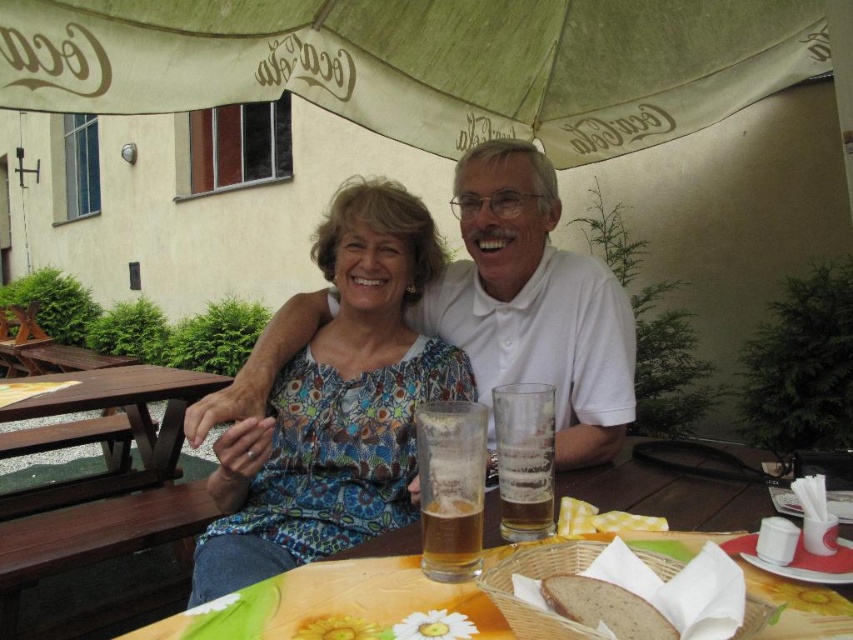
Between beige fabric umbrella at upper center and wooden table at center, which one is positioned higher?

beige fabric umbrella at upper center is above.

Is point (120, 60) farther from viewer compared to point (712, 506)?

Yes, it is behind point (712, 506).

Which is behind, point (242, 76) or point (490, 508)?

The point (242, 76) is behind.

At what (x,y) coordinates should I click in order to perform the action: click on beige fabric umbrella at upper center. Please return your answer as a coordinate pair (x, y). Looking at the image, I should click on (422, 64).

The height and width of the screenshot is (640, 853). In order to click on wooden table at center in this screenshot , I will do `click(670, 500)`.

Is wooden table at center shorter than yellow checkered napkin at lower center?

In fact, wooden table at center may be taller than yellow checkered napkin at lower center.

Which is in front, point (479, 625) or point (596, 508)?

Positioned in front is point (479, 625).

In order to click on wooden table at center in this screenshot , I will do `click(670, 500)`.

Is point (289, 371) positioned in front of point (624, 625)?

No, it is not.

This screenshot has height=640, width=853. In order to click on floral fabric blouse at center in this screenshot , I will do `click(335, 404)`.

Locate an element on the screen. floral fabric blouse at center is located at coordinates (335, 404).